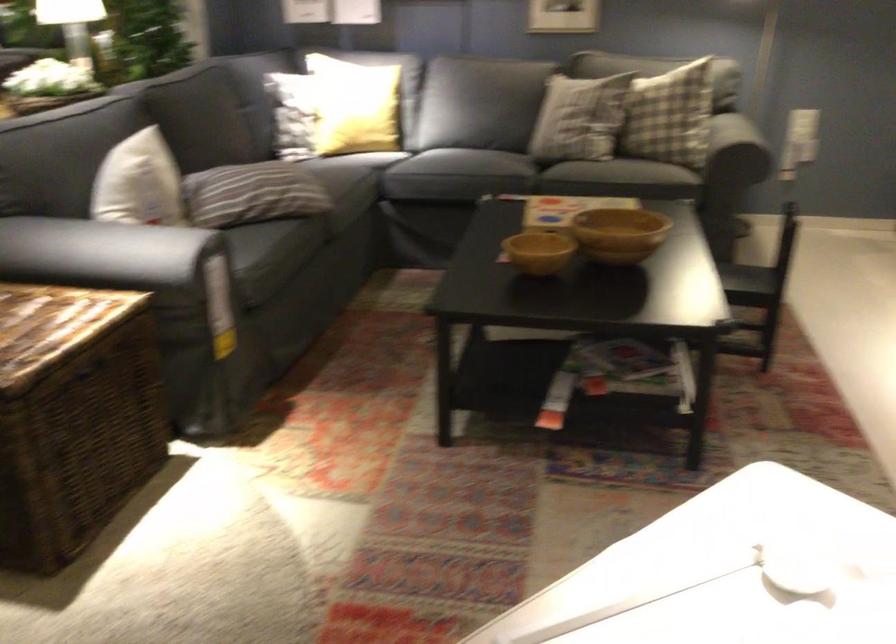
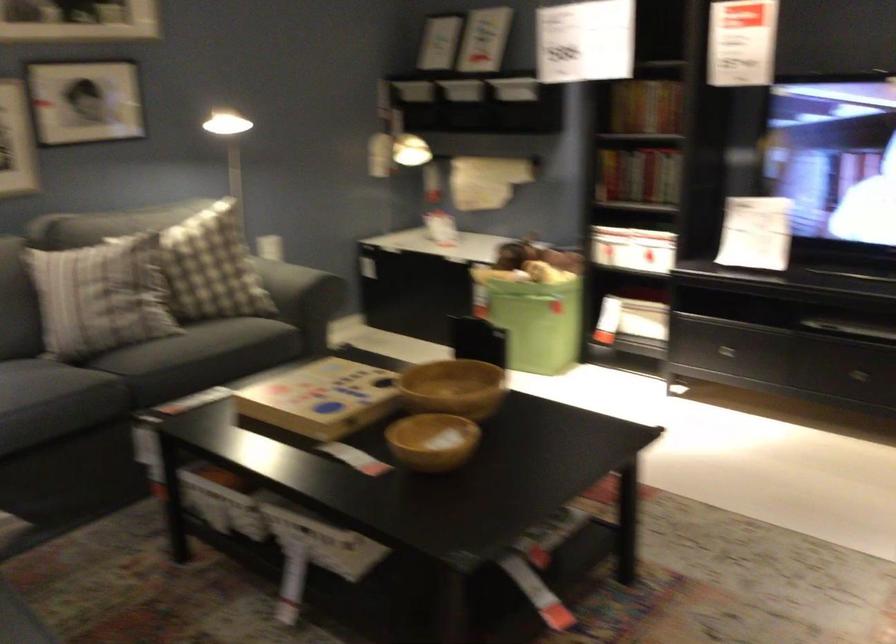
The point at (548, 254) is marked in the first image. Where is the corresponding point in the second image?

(433, 440)